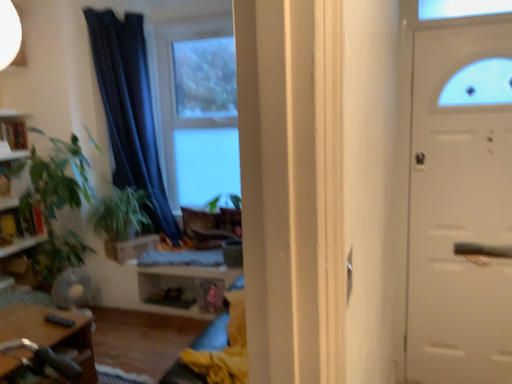
Where is `free spot above clear glass window at center (from a real-world perspective)`? free spot above clear glass window at center (from a real-world perspective) is located at coordinates (195, 23).